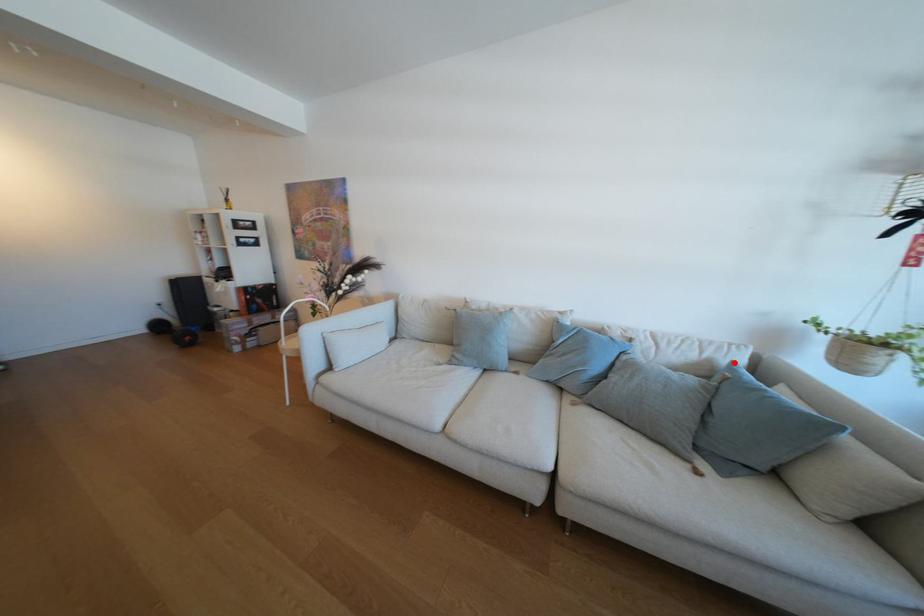
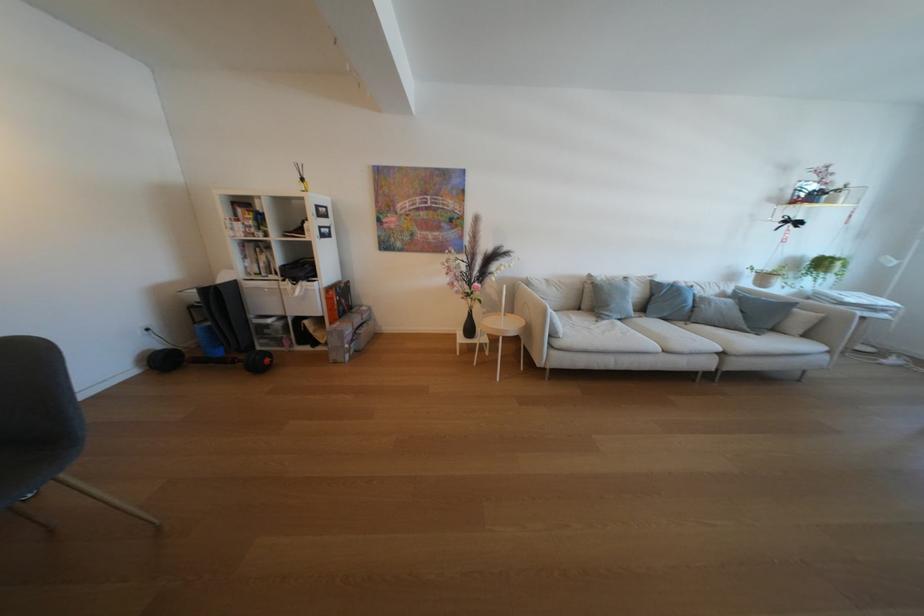
Locate, in the second image, the point that corresponds to the highlighted location in the first image.

(739, 292)